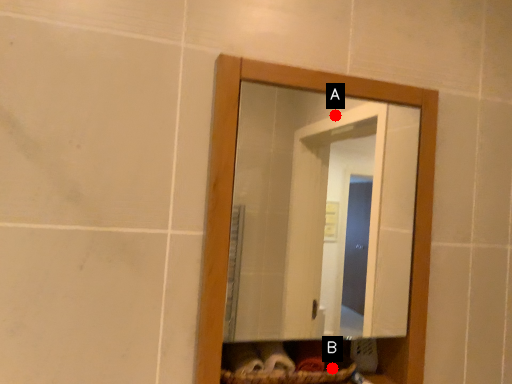
Question: Two points are circled on the image, labeled by A and B beside each circle. Which point is closer to the camera taking this photo?

Choices:
 (A) A is closer
 (B) B is closer

Answer: (B)